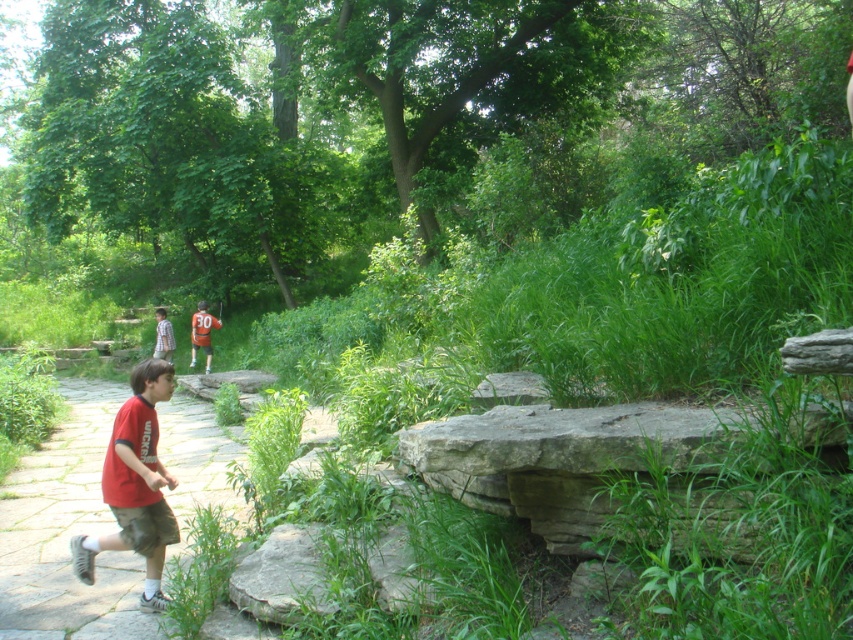
Does red fabric shirt at center have a lesser width compared to plaid shirt at center?

No, red fabric shirt at center is not thinner than plaid shirt at center.

Between red fabric shirt at center and plaid shirt at center, which one appears on the left side from the viewer's perspective?

plaid shirt at center is more to the left.

Who is more distant from viewer, (224, 454) or (166, 337)?

Point (166, 337)

What are the coordinates of `red fabric shirt at center` in the screenshot? It's located at (67, 532).

Who is positioned more to the right, red cotton shirt at left or orange jersey at center?

From the viewer's perspective, red cotton shirt at left appears more on the right side.

Does red cotton shirt at left appear under orange jersey at center?

Yes, red cotton shirt at left is below orange jersey at center.

Between point (125, 502) and point (202, 321), which one is positioned in front?

Point (125, 502) is more forward.

Image resolution: width=853 pixels, height=640 pixels. In order to click on red cotton shirt at left in this screenshot , I will do `click(135, 484)`.

Who is taller, red fabric shirt at center or red cotton shirt at left?

With more height is red cotton shirt at left.

Which is more to the right, red fabric shirt at center or red cotton shirt at left?

Positioned to the right is red cotton shirt at left.

Consider the image. Who is more forward, (4,529) or (161,604)?

Point (161,604) is more forward.

At what (x,y) coordinates should I click in order to perform the action: click on red fabric shirt at center. Please return your answer as a coordinate pair (x, y). This screenshot has height=640, width=853. Looking at the image, I should click on (67, 532).